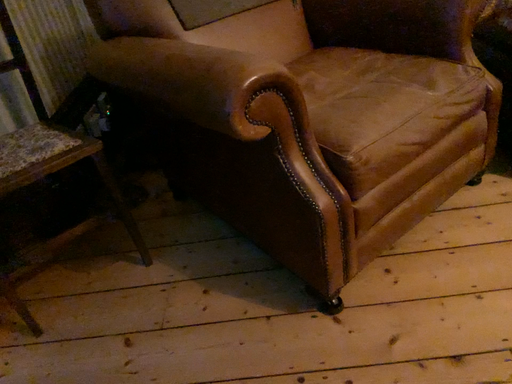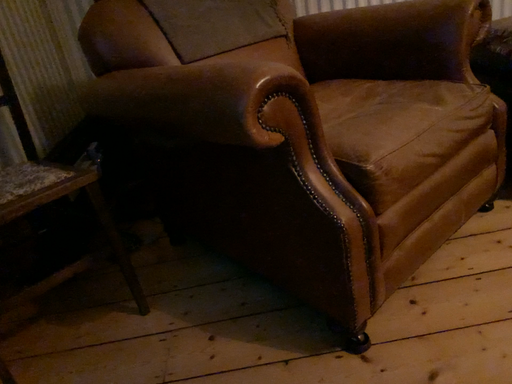
Question: Which way did the camera rotate in the video?

Choices:
 (A) rotated downward
 (B) rotated upward

Answer: (B)